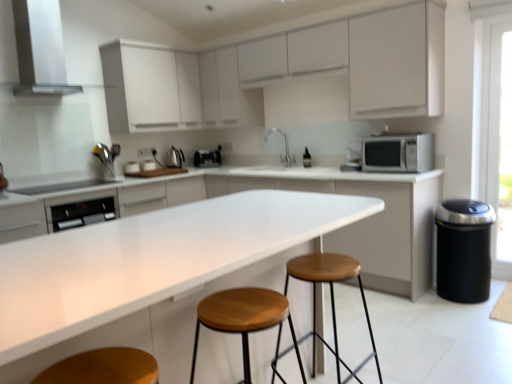
Question: From the image's perspective, is satin black toaster at center, placed as the 1th appliance when sorted from back to front, above or below white glossy toaster at upper center, which appears as the 1th appliance when viewed from the left?

Choices:
 (A) below
 (B) above

Answer: (B)

Question: Is satin black toaster at center, the 3th appliance in the left-to-right sequence, wider or thinner than white glossy toaster at upper center, which appears as the 1th appliance when viewed from the left?

Choices:
 (A) wide
 (B) thin

Answer: (A)

Question: Which object is the closest to the white matte cabinet at upper left, which is the 3th cabinetry from bottom to top?

Choices:
 (A) stainless steel exhaust hood at upper left
 (B) white glossy toaster at upper center, positioned as the 3th appliance in back-to-front order
 (C) silver metallic microwave at right
 (D) satin nickel faucet at center
 (E) white glossy countertop at center

Answer: (A)

Question: Estimate the real-world distances between objects in this image. Which object is farther from the satin black toaster at center, which is the second appliance from right to left?

Choices:
 (A) stainless steel exhaust hood at upper left
 (B) wooden seat stool at center, which appears as the 2th stool when viewed from the back
 (C) white glossy toaster at upper center, the second appliance ordered from the bottom
 (D) satin silver kettle at upper left, which is the second appliance from left to right
 (E) white glossy countertop at center

Answer: (B)